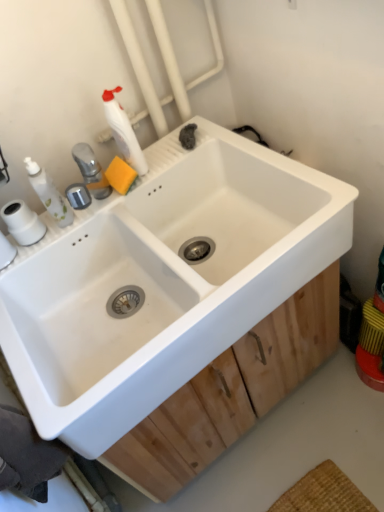
Question: Is white plastic soap dispenser at upper left beside white ceramic sink at center?

Choices:
 (A) no
 (B) yes

Answer: (A)

Question: Considering the relative sizes of white plastic soap dispenser at upper left and white ceramic sink at center in the image provided, is white plastic soap dispenser at upper left thinner than white ceramic sink at center?

Choices:
 (A) no
 (B) yes

Answer: (B)

Question: Does white plastic soap dispenser at upper left have a larger size compared to white ceramic sink at center?

Choices:
 (A) yes
 (B) no

Answer: (B)

Question: From a real-world perspective, is white plastic soap dispenser at upper left under white ceramic sink at center?

Choices:
 (A) no
 (B) yes

Answer: (A)

Question: Is white plastic soap dispenser at upper left at the right side of white ceramic sink at center?

Choices:
 (A) no
 (B) yes

Answer: (A)

Question: Is white plastic soap dispenser at upper left smaller than white ceramic sink at center?

Choices:
 (A) yes
 (B) no

Answer: (A)

Question: Is white plastic soap dispenser at upper left turned away from wooden at center?

Choices:
 (A) no
 (B) yes

Answer: (A)

Question: Considering the relative sizes of white plastic soap dispenser at upper left and wooden at center in the image provided, is white plastic soap dispenser at upper left bigger than wooden at center?

Choices:
 (A) no
 (B) yes

Answer: (A)

Question: Does white plastic soap dispenser at upper left have a lesser height compared to wooden at center?

Choices:
 (A) yes
 (B) no

Answer: (B)

Question: Is white plastic soap dispenser at upper left in front of wooden at center?

Choices:
 (A) no
 (B) yes

Answer: (B)

Question: Can you confirm if white plastic soap dispenser at upper left is positioned to the left of wooden at center?

Choices:
 (A) yes
 (B) no

Answer: (A)

Question: From the image's perspective, is white plastic soap dispenser at upper left above wooden at center?

Choices:
 (A) yes
 (B) no

Answer: (A)

Question: Is white ceramic sink at center to the right of white matte bottle at upper left from the viewer's perspective?

Choices:
 (A) no
 (B) yes

Answer: (B)